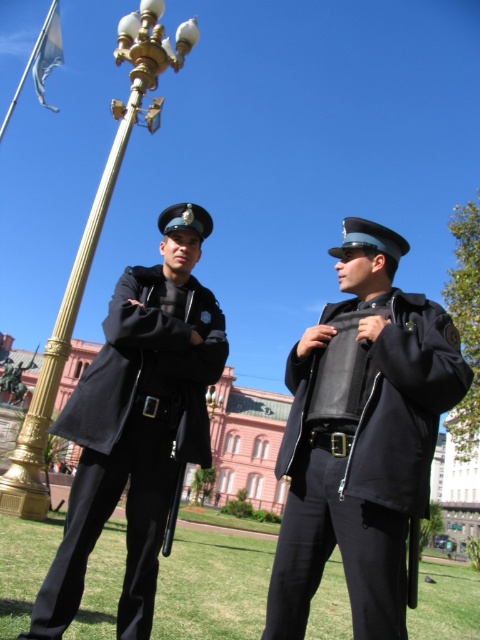
Question: Among these points, which one is nearest to the camera?

Choices:
 (A) pyautogui.click(x=62, y=422)
 (B) pyautogui.click(x=387, y=449)
 (C) pyautogui.click(x=156, y=33)
 (D) pyautogui.click(x=50, y=6)

Answer: (B)

Question: Where is black leather jacket at center located in relation to black matte uniform at left in the image?

Choices:
 (A) right
 (B) left

Answer: (A)

Question: Is black leather jacket at center closer to camera compared to black matte uniform at left?

Choices:
 (A) yes
 (B) no

Answer: (A)

Question: Considering the relative positions of gold polished metal lamp post at upper left and gold polished metal flag pole at upper left in the image provided, where is gold polished metal lamp post at upper left located with respect to gold polished metal flag pole at upper left?

Choices:
 (A) right
 (B) left

Answer: (A)

Question: Which object appears closest to the camera in this image?

Choices:
 (A) gold polished metal lamp post at upper left
 (B) gold polished metal flag pole at upper left

Answer: (A)

Question: Which object is the farthest from the black matte uniform at left?

Choices:
 (A) gold polished metal lamp post at upper left
 (B) matte black uniform at center
 (C) gold polished metal flag pole at upper left
 (D) black leather jacket at center

Answer: (C)